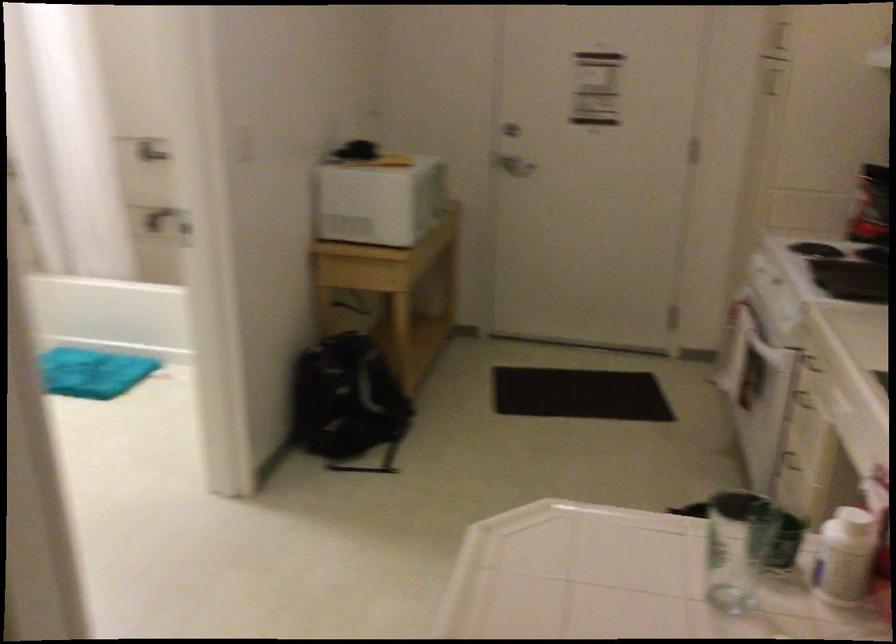
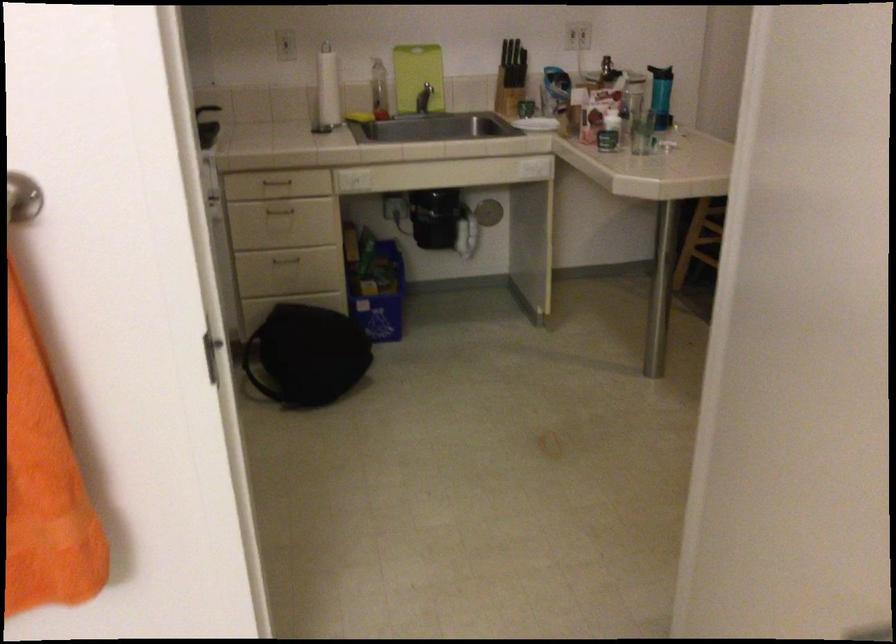
The point at (804, 466) is marked in the first image. Where is the corresponding point in the second image?

(287, 261)